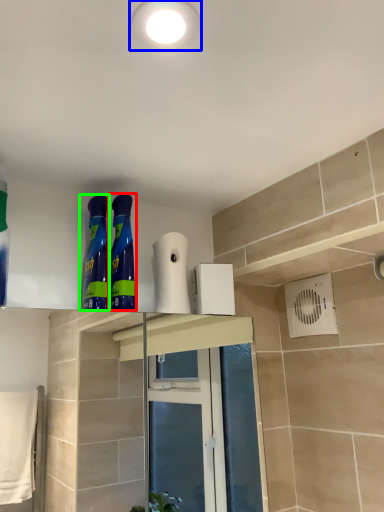
Question: Based on their relative distances, which object is farther from cleaning product (highlighted by a red box)? Choose from lighting (highlighted by a blue box) and cleaning product (highlighted by a green box).

Choices:
 (A) lighting
 (B) cleaning product

Answer: (A)